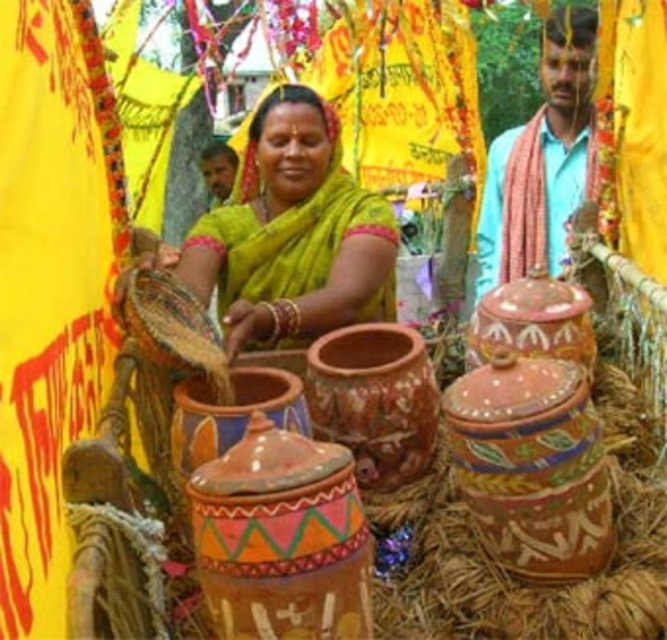
You are attending a cultural event and notice two people dressed in traditional clothing. One is wearing a matte yellow saree at center, and the other has a light blue cotton shirt at upper right. Based on their positions in the image, which person is closer to you?

The matte yellow saree at center is closer to you because it is in front of the light blue cotton shirt at upper right.

You are an event organizer at the cultural festival and need to place a decorative item on the larger of the two terracotta containers. Which one should you choose between the terracotta pot at center and the terracotta jar at center?

The terracotta pot at center is larger in size than the terracotta jar at center, so you should choose the terracotta pot at center for placing the decorative item.